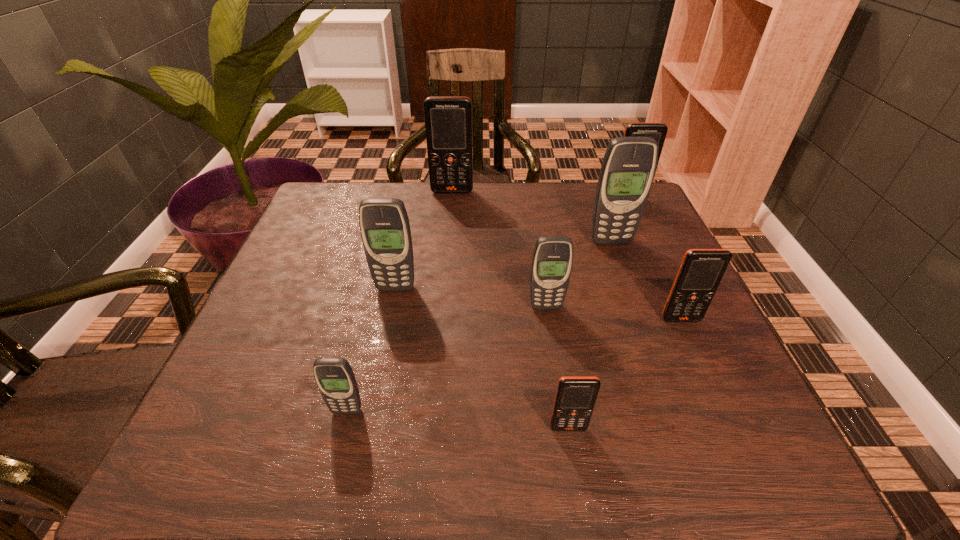
The height and width of the screenshot is (540, 960). I want to click on the biggest orange cellular telephone, so click(x=448, y=120).

This screenshot has width=960, height=540. Identify the location of the leftmost orange cellular telephone. (448, 120).

Locate an element on the screen. the third farthest object is located at coordinates (627, 172).

The height and width of the screenshot is (540, 960). In order to click on the sixth nearest cellular telephone in this screenshot , I will do `click(627, 172)`.

In order to click on the seventh nearest object in this screenshot , I will do `click(657, 131)`.

Where is `the second farthest cellular telephone`? This screenshot has height=540, width=960. the second farthest cellular telephone is located at coordinates (657, 131).

Locate an element on the screen. The width and height of the screenshot is (960, 540). the fourth farthest object is located at coordinates click(385, 230).

This screenshot has height=540, width=960. What are the coordinates of `the third smallest gray cellular telephone` in the screenshot? It's located at (385, 230).

You are a GUI agent. You are given a task and a screenshot of the screen. Output one action in this format:
    pyautogui.click(x=<x>, y=<y>)
    Task: Click on the second smallest gray cellular telephone
    
    Given the screenshot: What is the action you would take?
    pyautogui.click(x=552, y=260)

Where is `the fifth farthest object`? This screenshot has width=960, height=540. the fifth farthest object is located at coordinates [x=552, y=260].